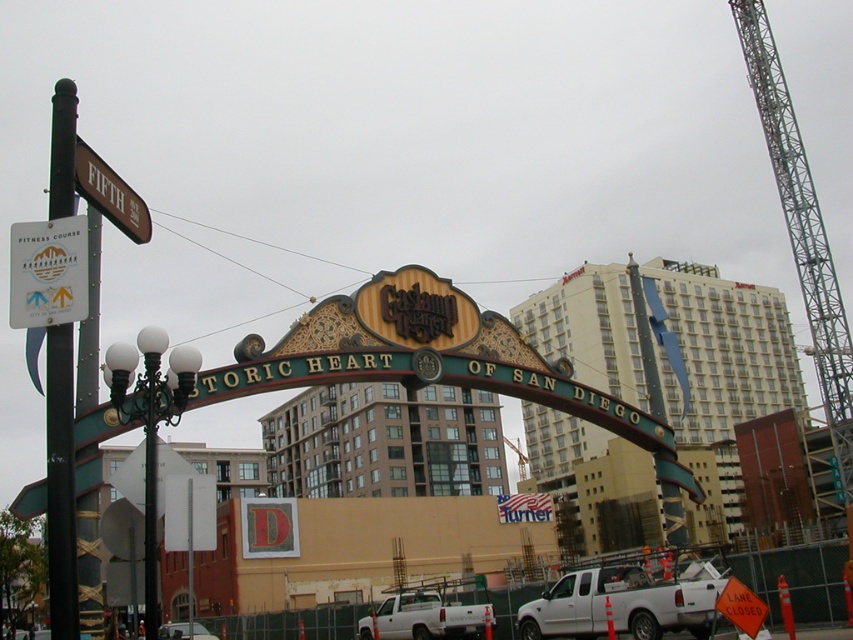
Question: From the image, what is the correct spatial relationship of white plastic sign at upper left in relation to brown wooden sign at upper left?

Choices:
 (A) below
 (B) above

Answer: (A)

Question: Does white matte truck at center have a lesser width compared to white plastic sign at upper left?

Choices:
 (A) yes
 (B) no

Answer: (B)

Question: Among these objects, which one is nearest to the camera?

Choices:
 (A) white matte truck at lower center
 (B) white plastic sign at upper left

Answer: (B)

Question: Estimate the real-world distances between objects in this image. Which object is farther from the white plastic sign at upper left?

Choices:
 (A) white matte truck at lower center
 (B) black metal pole at left

Answer: (A)

Question: Which object is farther from the camera taking this photo?

Choices:
 (A) metallic silver car at center
 (B) brown wooden sign at upper left
 (C) white matte truck at lower center

Answer: (A)

Question: From the image, what is the correct spatial relationship of white matte truck at lower center in relation to metallic silver car at center?

Choices:
 (A) below
 (B) above

Answer: (B)